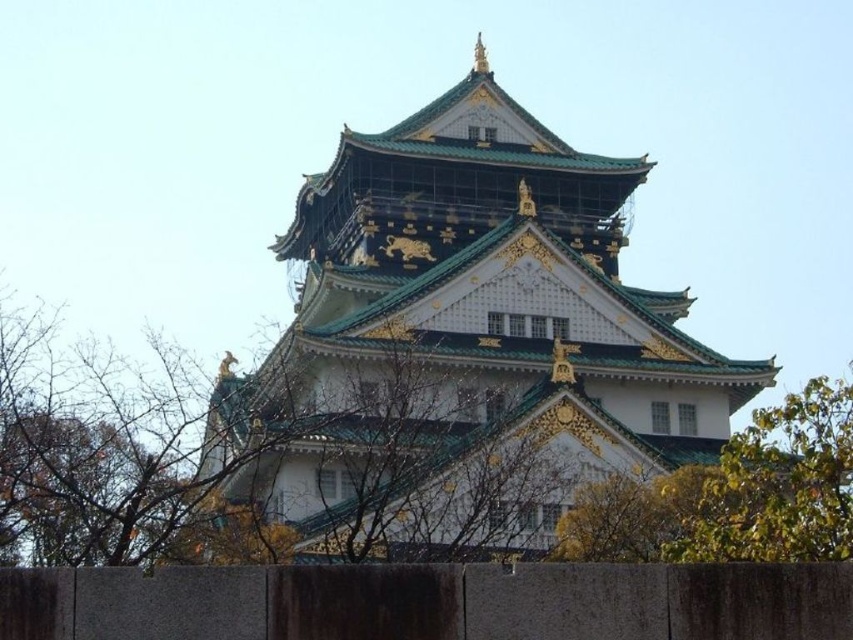
Is point (252, 444) closer to viewer compared to point (750, 490)?

No, it is not.

In the scene shown: Can you confirm if green matte tower at center is positioned above green leafy tree at right?

Yes, green matte tower at center is above green leafy tree at right.

Is point (630, 320) less distant than point (846, 497)?

No, it is not.

Find the location of a particular element. Image resolution: width=853 pixels, height=640 pixels. green matte tower at center is located at coordinates (462, 344).

Can you confirm if green matte tower at center is positioned to the left of green leafy tree at center?

In fact, green matte tower at center is to the right of green leafy tree at center.

Can you confirm if green matte tower at center is positioned above green leafy tree at center?

Indeed, green matte tower at center is positioned over green leafy tree at center.

Between point (468, 380) and point (206, 458), which one is positioned behind?

The point (206, 458) is more distant.

Locate an element on the screen. The height and width of the screenshot is (640, 853). green matte tower at center is located at coordinates (462, 344).

Does green leafy tree at center have a larger size compared to green leafy tree at right?

No, green leafy tree at center is not bigger than green leafy tree at right.

Is point (462, 387) behind point (804, 492)?

Yes.

Who is more distant from viewer, [358,481] or [787,518]?

Point [358,481]

The width and height of the screenshot is (853, 640). Find the location of `green leafy tree at center`. green leafy tree at center is located at coordinates (387, 448).